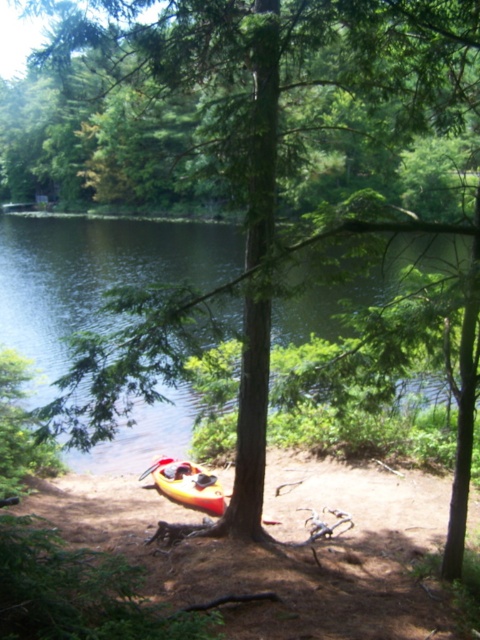
In the scene shown: Does green liquid water at lower center have a lesser width compared to yellow plastic kayak at lower center?

Incorrect, green liquid water at lower center's width is not less than yellow plastic kayak at lower center's.

Is green liquid water at lower center below yellow plastic kayak at lower center?

Incorrect, green liquid water at lower center is not positioned below yellow plastic kayak at lower center.

Is point (159, 268) positioned in front of point (163, 486)?

No.

Find the location of a particular element. green liquid water at lower center is located at coordinates (94, 275).

Which of these two, orange kayak at lower center or yellow plastic kayak at lower center, stands taller?

With more height is yellow plastic kayak at lower center.

Measure the distance between orange kayak at lower center and camera.

orange kayak at lower center and camera are 5.94 meters apart.

The image size is (480, 640). I want to click on orange kayak at lower center, so click(x=279, y=548).

Between orange kayak at lower center and green liquid water at lower center, which one appears on the left side from the viewer's perspective?

green liquid water at lower center is more to the left.

Find the location of a particular element. The height and width of the screenshot is (640, 480). orange kayak at lower center is located at coordinates (279, 548).

Identify the location of orange kayak at lower center. (279, 548).